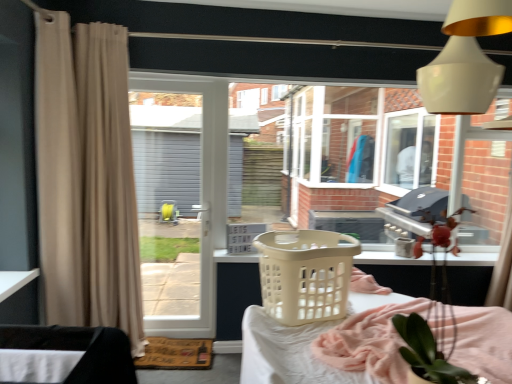
Question: From a real-world perspective, is beige plastic basket at center, which is counted as the 2th basket, starting from the back, positioned above or below white glossy lampshade at upper right?

Choices:
 (A) above
 (B) below

Answer: (B)

Question: Is beige plastic basket at center, which is counted as the 2th basket, starting from the back, situated inside white glossy lampshade at upper right or outside?

Choices:
 (A) inside
 (B) outside

Answer: (B)

Question: Which object is positioned closest to the white fabric at lower left?

Choices:
 (A) white plastic laundry basket at center, positioned as the 2th basket in front-to-back order
 (B) beige plastic basket at center, which is counted as the 2th basket, starting from the back
 (C) white glossy door at center
 (D) beige fabric curtain at left, acting as the second curtain starting from the right
 (E) black fabric at lower left, the 1th furniture in the left-to-right sequence

Answer: (E)

Question: Which object is the closest to the black fabric at lower left, which is counted as the 2th furniture, starting from the back?

Choices:
 (A) white fabric at lower left
 (B) white glossy door at center
 (C) beige fabric curtain at left, which appears as the second curtain when viewed from the left
 (D) green leafy plant at lower right
 (E) white glossy lampshade at upper right

Answer: (A)